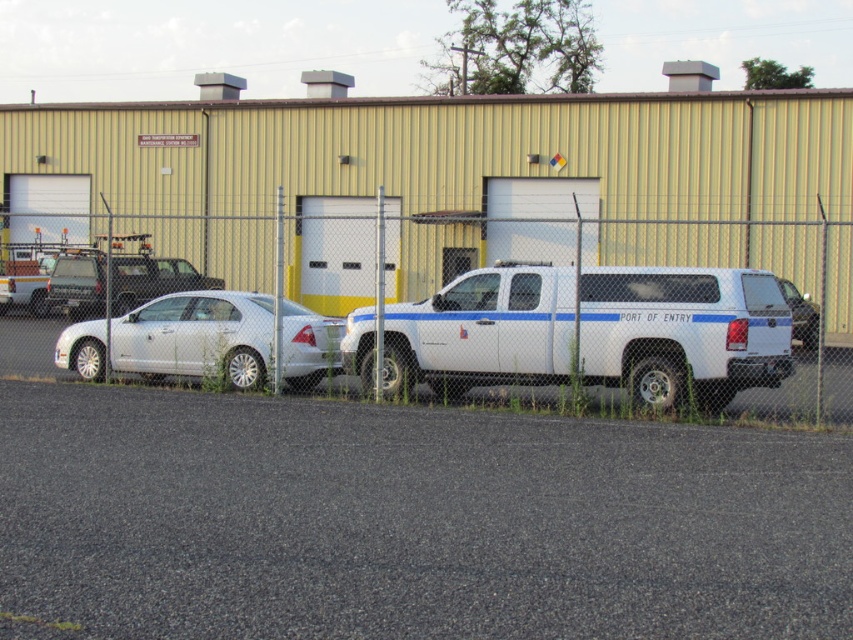
Can you confirm if gray asphalt parking lot at lower center is shorter than white glossy truck at center?

Yes.

Does gray asphalt parking lot at lower center appear over white glossy truck at center?

Incorrect, gray asphalt parking lot at lower center is not positioned above white glossy truck at center.

Who is more forward, [817,481] or [793,332]?

Point [817,481]

Locate an element on the screen. The width and height of the screenshot is (853, 640). gray asphalt parking lot at lower center is located at coordinates (409, 522).

Does white matte truck at center appear under white matte sedan at left?

No, white matte truck at center is not below white matte sedan at left.

Does point (469, 278) come in front of point (161, 355)?

Yes, point (469, 278) is in front of point (161, 355).

You are a GUI agent. You are given a task and a screenshot of the screen. Output one action in this format:
    pyautogui.click(x=<x>, y=<y>)
    Task: Click on the white matte truck at center
    
    Given the screenshot: What is the action you would take?
    pyautogui.click(x=682, y=332)

Does point (498, 422) come farther from viewer compared to point (606, 304)?

No, (498, 422) is in front of (606, 304).

Who is more distant from viewer, (225, 412) or (561, 364)?

The point (561, 364) is more distant.

Find the location of `gray asphalt parking lot at lower center`. gray asphalt parking lot at lower center is located at coordinates [x=409, y=522].

At what (x,y) coordinates should I click in order to perform the action: click on gray asphalt parking lot at lower center. Please return your answer as a coordinate pair (x, y). This screenshot has height=640, width=853. Looking at the image, I should click on (409, 522).